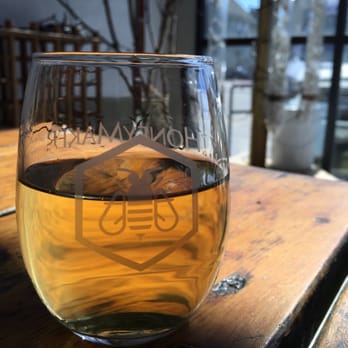
This screenshot has width=348, height=348. Identify the location of black ties holding curtain open. pyautogui.click(x=276, y=96), pyautogui.click(x=308, y=97).